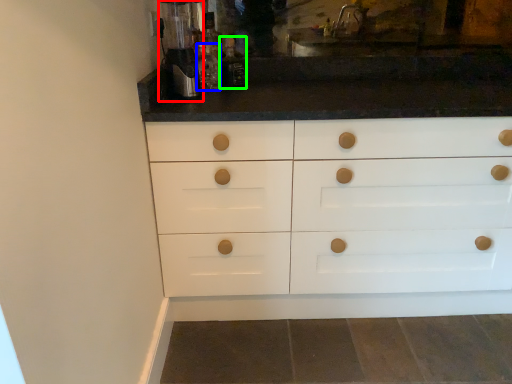
Question: Which object is the closest to the coffee machine (highlighted by a red box)? Choose among these: bottle (highlighted by a blue box) or bottle (highlighted by a green box).

Choices:
 (A) bottle
 (B) bottle

Answer: (A)